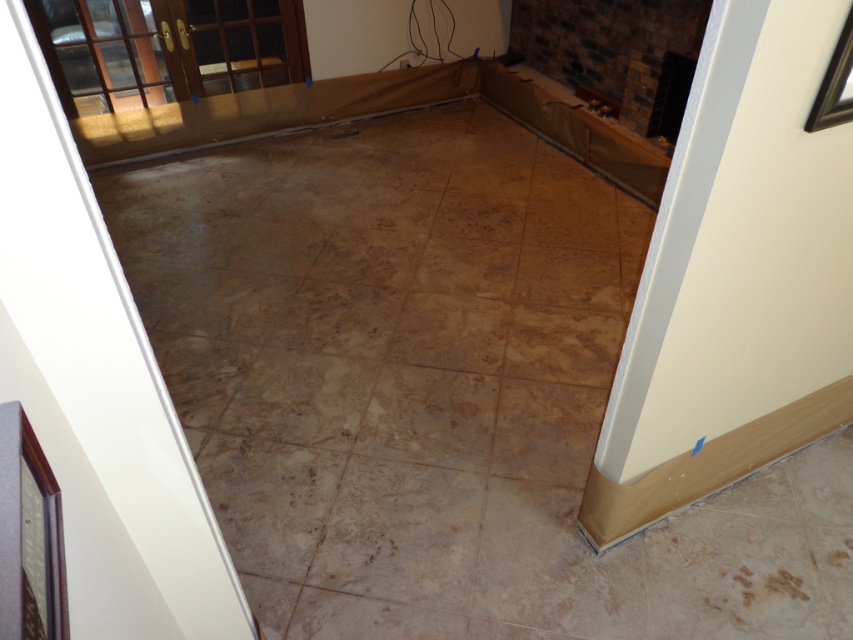
Question: Is white painted wood baseboard at lower right below brown travertine tile at center?

Choices:
 (A) yes
 (B) no

Answer: (B)

Question: Observing the image, what is the correct spatial positioning of white painted wood baseboard at lower right in reference to brown travertine tile at center?

Choices:
 (A) right
 (B) left

Answer: (A)

Question: Among these objects, which one is farthest from the camera?

Choices:
 (A) white painted wood baseboard at lower right
 (B) brown travertine tile at center

Answer: (B)

Question: Among these points, which one is farthest from the camera?

Choices:
 (A) (792, 86)
 (B) (451, 554)

Answer: (B)

Question: Can you confirm if white painted wood baseboard at lower right is positioned above brown travertine tile at center?

Choices:
 (A) no
 (B) yes

Answer: (B)